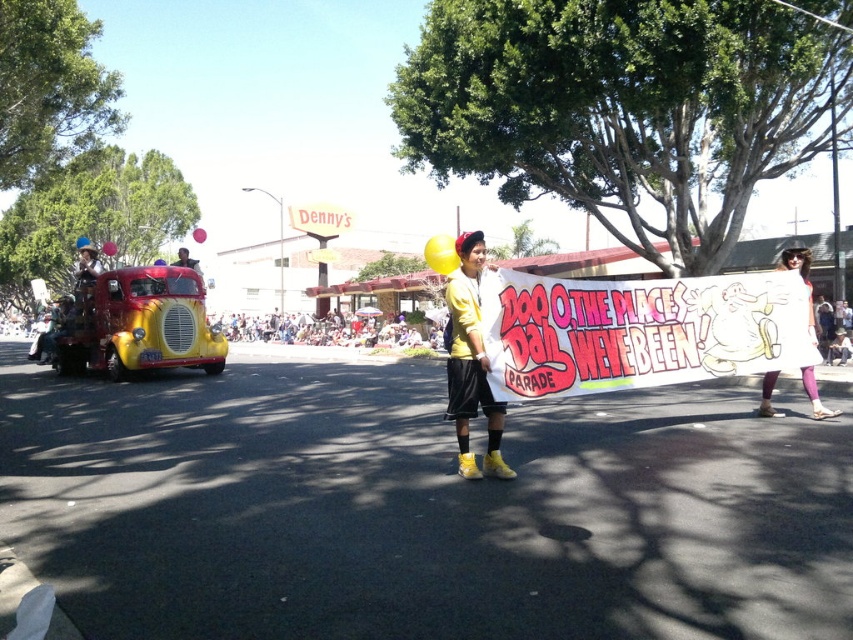
Question: Which object appears closest to the camera in this image?

Choices:
 (A) white fabric dress at center
 (B) yellow matte shirt at center

Answer: (B)

Question: Is yellow matte shirt at center in front of white fabric dress at center?

Choices:
 (A) yes
 (B) no

Answer: (A)

Question: Does yellow matte shirt at center have a lesser width compared to white fabric dress at center?

Choices:
 (A) yes
 (B) no

Answer: (A)

Question: Which point is closer to the camera taking this photo?

Choices:
 (A) (453, 316)
 (B) (764, 384)

Answer: (A)

Question: From the image, what is the correct spatial relationship of yellow matte shirt at center in relation to white fabric dress at center?

Choices:
 (A) right
 (B) left

Answer: (B)

Question: Which point is farther to the camera?

Choices:
 (A) yellow matte shirt at center
 (B) white fabric dress at center

Answer: (B)